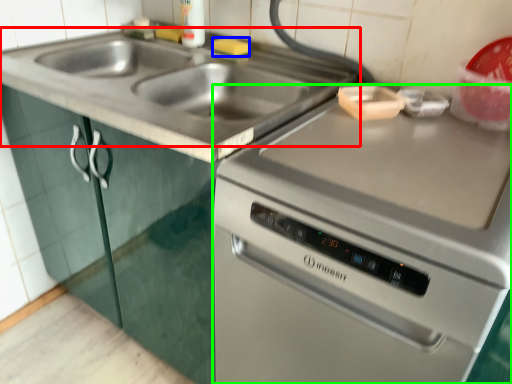
Question: Which is farther away from sink (highlighted by a red box)? food (highlighted by a blue box) or oven (highlighted by a green box)?

Choices:
 (A) food
 (B) oven

Answer: (B)